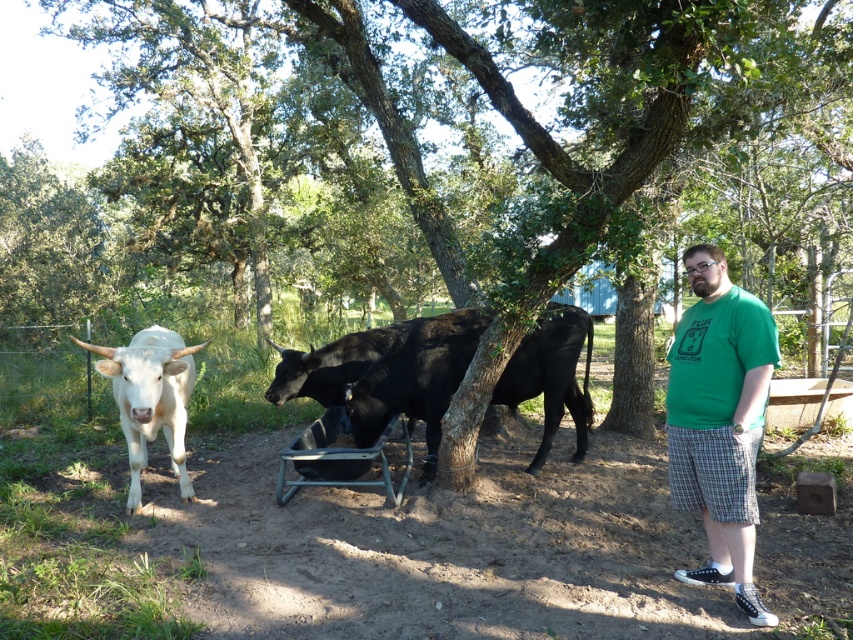
You are a farmer checking the pasture. You notice the green leafy tree at center and the black glossy bull at center. Which object is positioned higher in the scene?

The green leafy tree at center is positioned higher than the black glossy bull at center.

You are standing at the origin point of the coordinate system. The green leafy tree at center is located at point 0.223, 0.571. If you want to walk directly towards the tree, which direction should you head?

To walk directly towards the green leafy tree at center located at coordinates [486,141] from the origin, you should head in the direction of the tree which is at point [486,141].

You are standing at the point marked by coordinates point (389, 372). Looking around, you see a white cow with long horns on the left and a black glossy bull at center. Which cow is closer to your current position?

The black glossy bull at center is closer to your current position because the point (389, 372) is located on the black glossy bull at center, indicating it is the nearest cow.